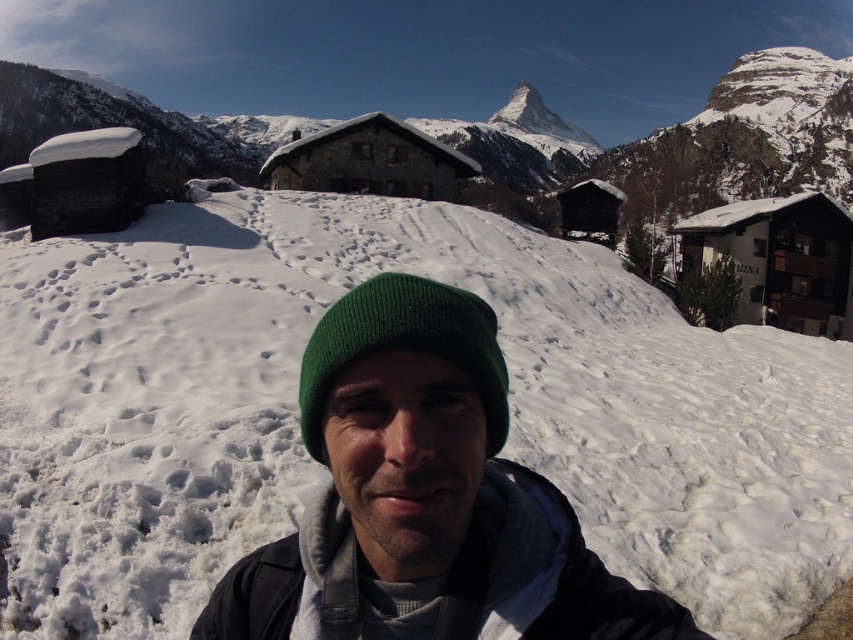
Is green knit cap at center bigger than green knitted hat at center?

Yes.

Based on the photo, who is positioned more to the right, green knit cap at center or green knitted hat at center?

green knitted hat at center

Is point (496, 596) in front of point (302, 401)?

Yes, it is in front of point (302, 401).

At what (x,y) coordinates should I click in order to perform the action: click on green knit cap at center. Please return your answer as a coordinate pair (x, y). Looking at the image, I should click on (424, 497).

Between white fluffy snow at center and green knitted hat at center, which one appears on the right side from the viewer's perspective?

white fluffy snow at center is more to the right.

Between white fluffy snow at center and green knitted hat at center, which one is positioned lower?

green knitted hat at center

Between point (701, 336) and point (303, 419), which one is positioned in front?

Point (303, 419)

You are a GUI agent. You are given a task and a screenshot of the screen. Output one action in this format:
    pyautogui.click(x=<x>, y=<y>)
    Task: Click on the white fluffy snow at center
    The image size is (853, 640).
    Given the screenshot: What is the action you would take?
    click(323, 467)

Can you confirm if white fluffy snow at center is thinner than green knit cap at center?

Incorrect, white fluffy snow at center's width is not less than green knit cap at center's.

Is white fluffy snow at center wider than green knit cap at center?

Indeed, white fluffy snow at center has a greater width compared to green knit cap at center.

This screenshot has width=853, height=640. What do you see at coordinates (323, 467) in the screenshot?
I see `white fluffy snow at center` at bounding box center [323, 467].

Where is `white fluffy snow at center`? white fluffy snow at center is located at coordinates (323, 467).